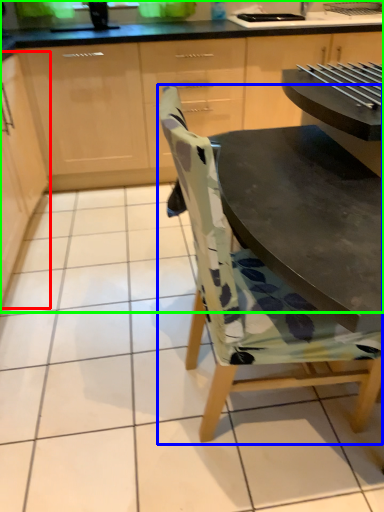
Question: Estimate the real-world distances between objects in this image. Which object is closer to cabinetry (highlighted by a red box), chair (highlighted by a blue box) or cabinetry (highlighted by a green box)?

Choices:
 (A) chair
 (B) cabinetry

Answer: (B)